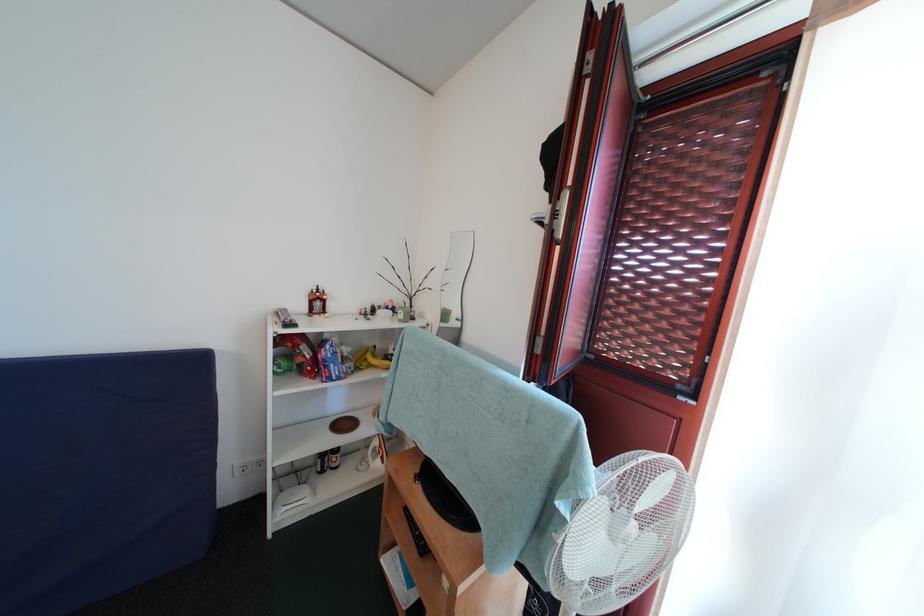
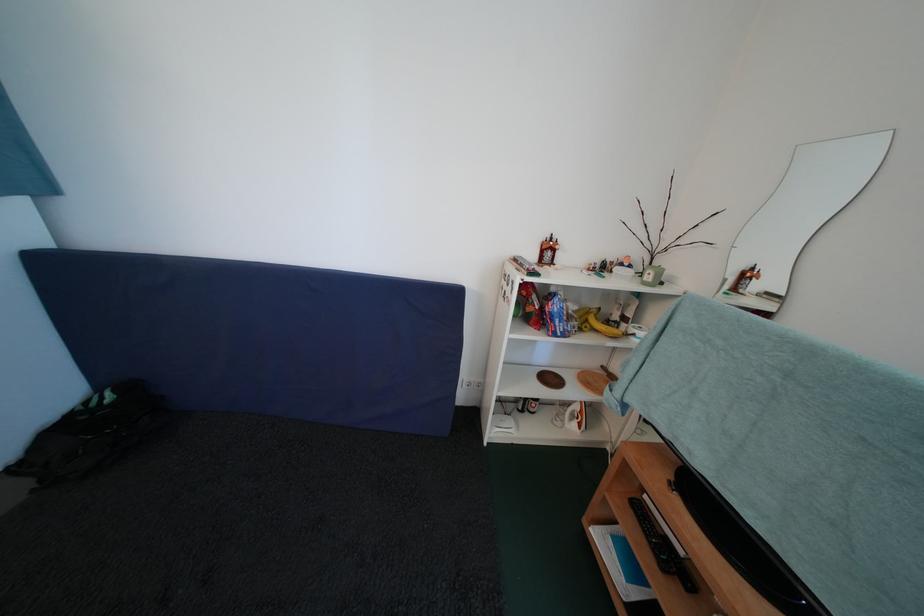
In the second image, find the point that corresponds to (x=383, y=448) in the first image.

(584, 411)